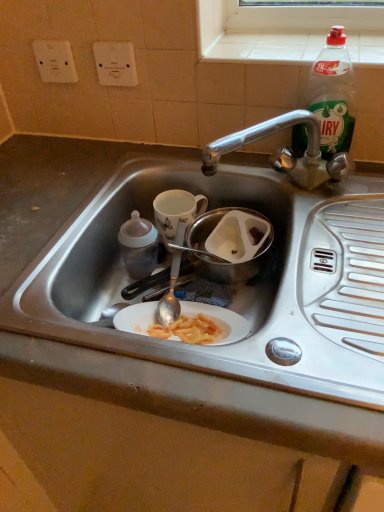
Question: Relative to white plastic electric outlet at upper left, acting as the second electric outlet starting from the right, is white plastic socket at upper center, arranged as the 2th electric outlet when viewed from the left, in front or behind?

Choices:
 (A) behind
 (B) front

Answer: (B)

Question: Choose the correct answer: Is white plastic socket at upper center, arranged as the 2th electric outlet when viewed from the left, inside white plastic electric outlet at upper left, acting as the second electric outlet starting from the right, or outside it?

Choices:
 (A) inside
 (B) outside

Answer: (B)

Question: Estimate the real-world distances between objects in this image. Which object is closer to the white plastic electric outlet at upper left, which is the 1th electric outlet in left-to-right order?

Choices:
 (A) translucent plastic baby bottle at left, the first bottle in the left-to-right sequence
 (B) stainless steel sink at center
 (C) green plastic bottle at upper right, which ranks as the first bottle in top-to-bottom order
 (D) porcelain floral mug at center
 (E) white plastic socket at upper center, which is the first electric outlet in right-to-left order

Answer: (E)

Question: Which is farther from the porcelain floral mug at center?

Choices:
 (A) translucent plastic baby bottle at left, the first bottle in the left-to-right sequence
 (B) green plastic bottle at upper right, which is the second bottle from left to right
 (C) metallic stainless steel bowl at center
 (D) white plastic socket at upper center, which is the first electric outlet in right-to-left order
 (E) white tile at upper center

Answer: (E)